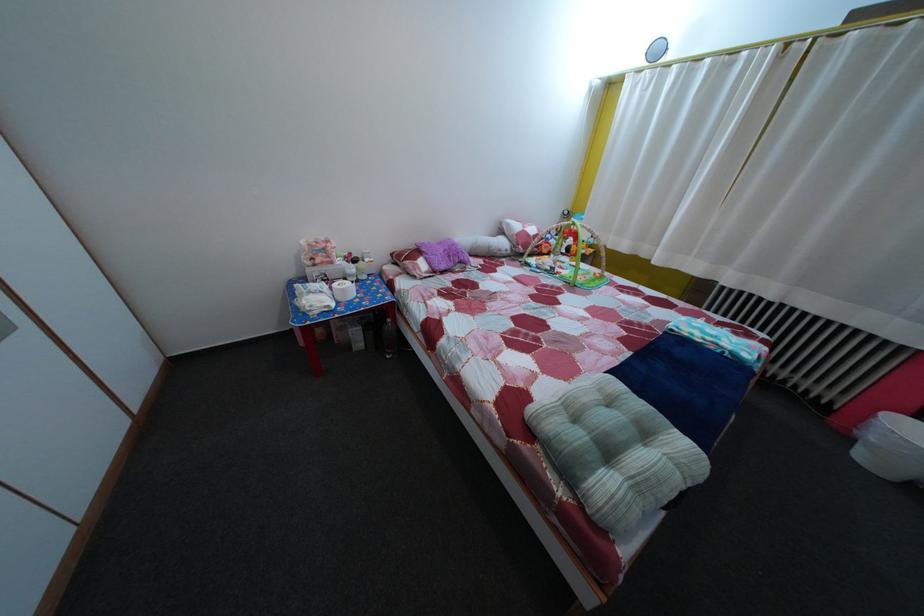
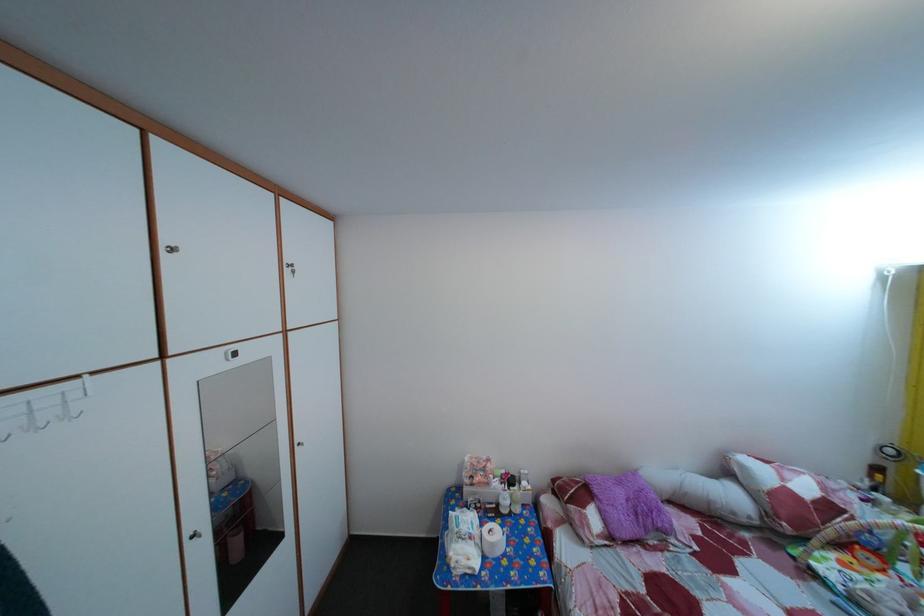
The point at [450,252] is marked in the first image. Where is the corresponding point in the second image?

(629, 491)